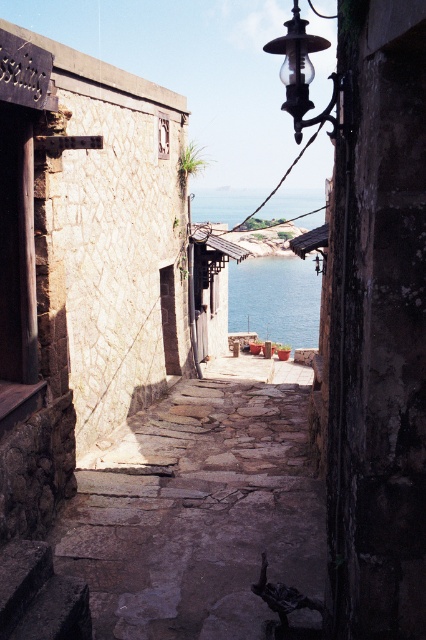
You are standing at the entrance of the alleyway and see the dark stone stairs at lower left marked by point (40, 595). If you walk straight ahead, will you reach the stairs before the end of the alley?

The dark stone stairs at lower left marked by point (40, 595) are located at the lower left corner of the alleyway. Walking straight ahead would take you towards the scenic coastal view at the end of the alley, so you would not reach the stairs before the alley ends.